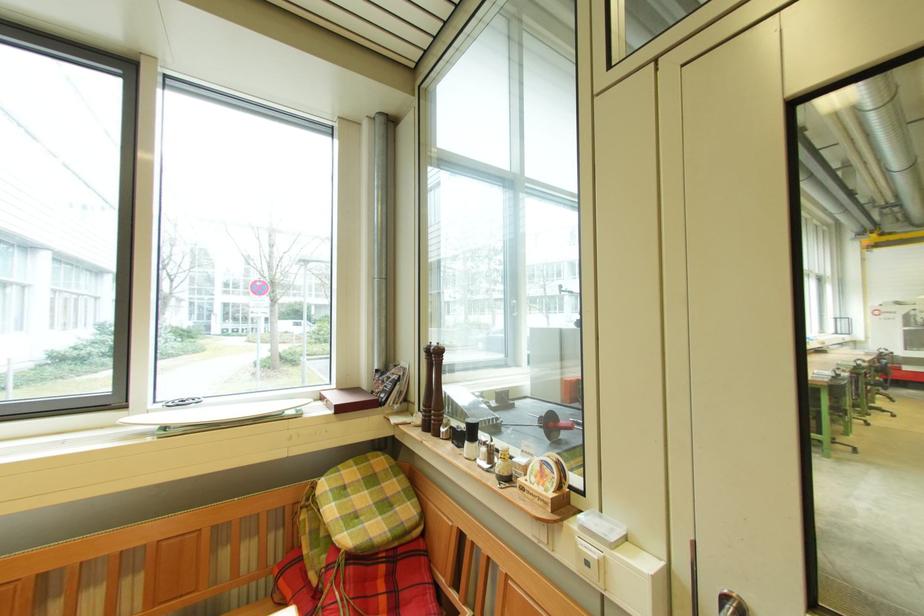
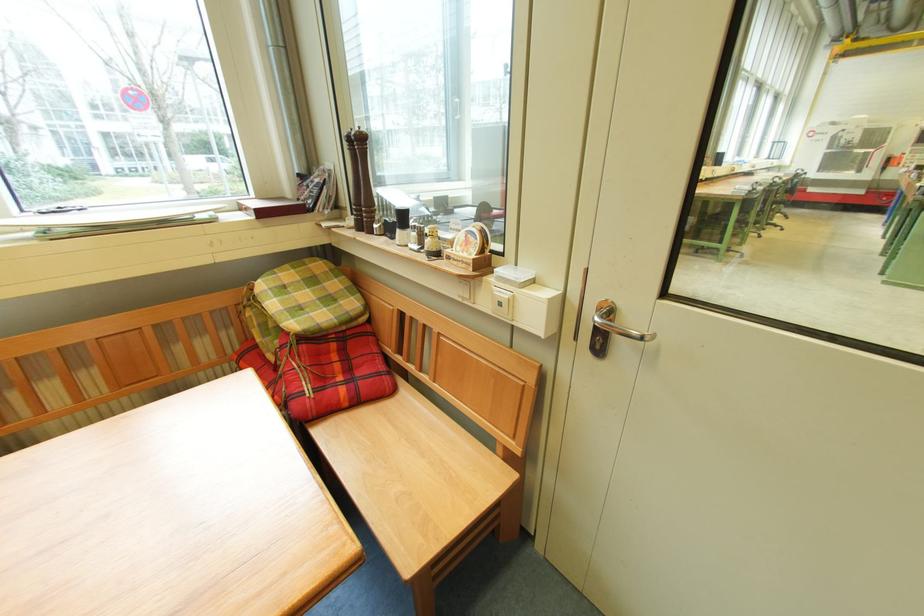
In the second image, find the point that corresponds to [432,355] in the first image.

(354, 144)